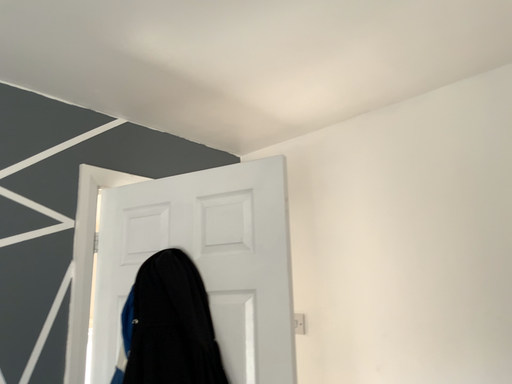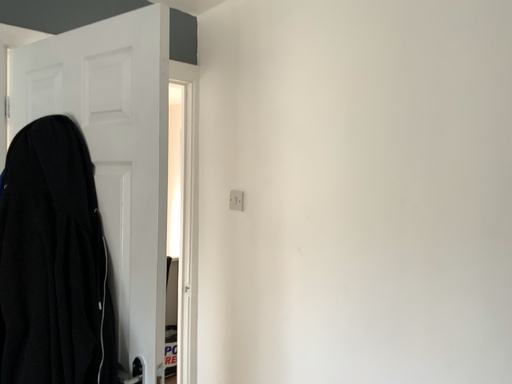
Question: Which way did the camera rotate in the video?

Choices:
 (A) rotated upward
 (B) rotated downward

Answer: (B)